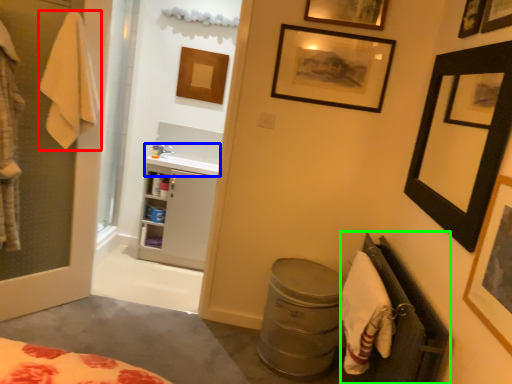
Question: Considering the real-world distances, which object is farthest from bath towel (highlighted by a red box)? sink (highlighted by a blue box) or closet (highlighted by a green box)?

Choices:
 (A) sink
 (B) closet

Answer: (B)